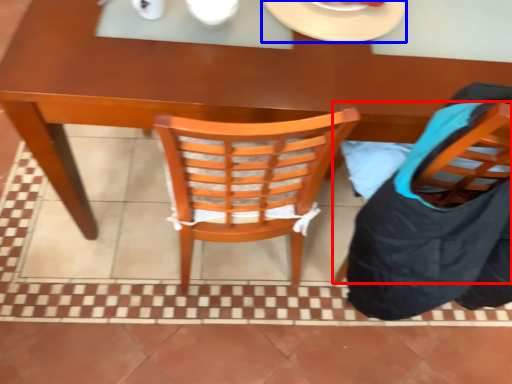
Question: Which object appears closest to the camera in this image, chair (highlighted by a red box) or plate (highlighted by a blue box)?

Choices:
 (A) chair
 (B) plate

Answer: (A)